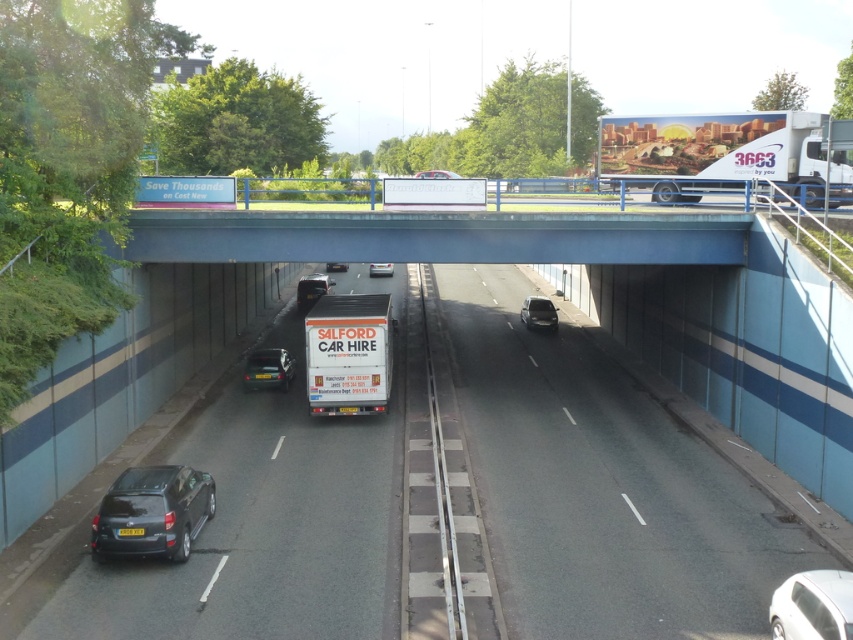
You are a pedestrian standing on the sidewalk and want to cross the asphalt road at center. The white glossy truck at upper center is approaching. Based on their positions, can you safely cross the road before the truck reaches your crossing point?

The asphalt road at center is in front of the white glossy truck at upper center, meaning the truck is further away from the road. Therefore, you can safely cross the asphalt road at center before the truck reaches your crossing point.

You are a pedestrian standing on the sidewalk next to the asphalt road at center. You want to cross the road to reach the white glossy sedan at lower right. Is the sedan located under the road you are on?

The asphalt road at center is positioned over the white glossy sedan at lower right, so yes, the white glossy sedan at lower right is located under the asphalt road at center.